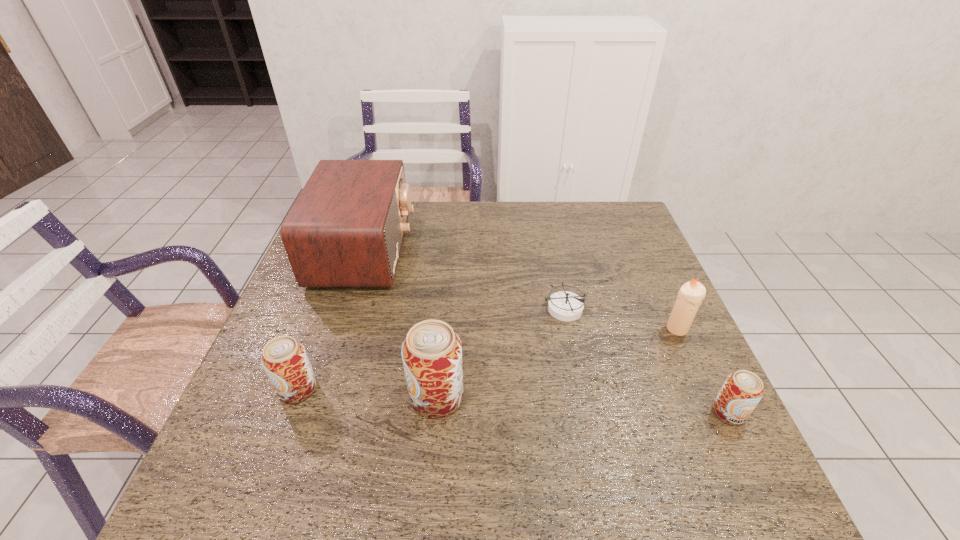
I want to click on the leftmost beer can, so click(284, 359).

The image size is (960, 540). I want to click on the third shortest object, so click(x=284, y=359).

Where is `the tallest beer can`? the tallest beer can is located at coordinates (432, 352).

Identify the location of the second beer can from right to left. This screenshot has width=960, height=540. (432, 352).

Locate an element on the screen. the shortest beer can is located at coordinates (741, 392).

Locate an element on the screen. This screenshot has height=540, width=960. the rightmost beer can is located at coordinates click(741, 392).

This screenshot has height=540, width=960. What are the coordinates of `the farthest object` in the screenshot? It's located at (346, 228).

What are the coordinates of `compass` in the screenshot? It's located at (566, 306).

At what (x,y) coordinates should I click in order to perform the action: click on the shortest object. Please return your answer as a coordinate pair (x, y). Looking at the image, I should click on (566, 306).

Locate an element on the screen. The image size is (960, 540). candle is located at coordinates (689, 298).